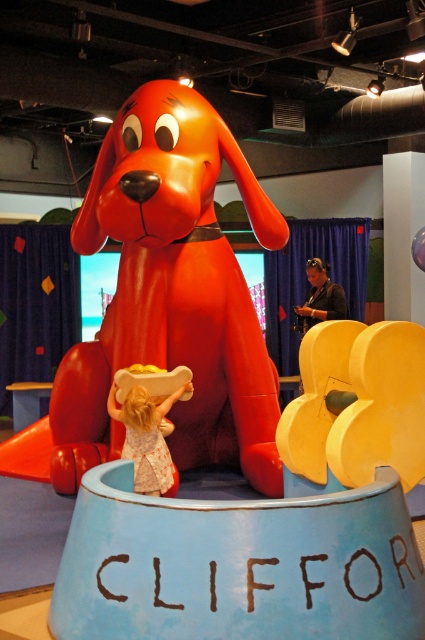
Question: Which object appears closest to the camera in this image?

Choices:
 (A) glossy plastic dog at center
 (B) light pink fabric dress at center

Answer: (B)

Question: Which of the following is the farthest from the observer?

Choices:
 (A) (218, 333)
 (B) (155, 426)

Answer: (A)

Question: Can you confirm if glossy plastic dog at center is smaller than light pink fabric dress at center?

Choices:
 (A) yes
 (B) no

Answer: (B)

Question: Where is glossy plastic dog at center located in relation to light pink fabric dress at center in the image?

Choices:
 (A) right
 (B) left

Answer: (A)

Question: Does glossy plastic dog at center appear over light pink fabric dress at center?

Choices:
 (A) yes
 (B) no

Answer: (A)

Question: Among these points, which one is farthest from the camera?

Choices:
 (A) (153, 424)
 (B) (166, 145)

Answer: (B)